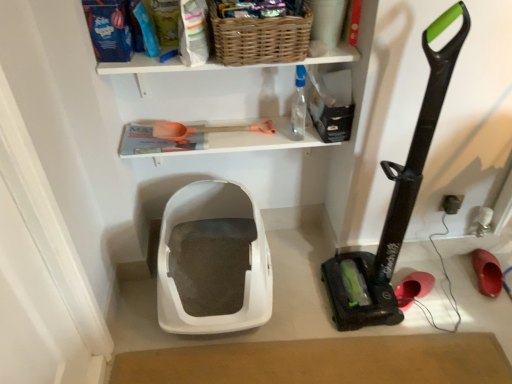
Locate an element on the screen. This screenshot has width=512, height=384. vacant area that lies between orange plastic shovel at upper center and transparent plastic bottle at upper center is located at coordinates (266, 127).